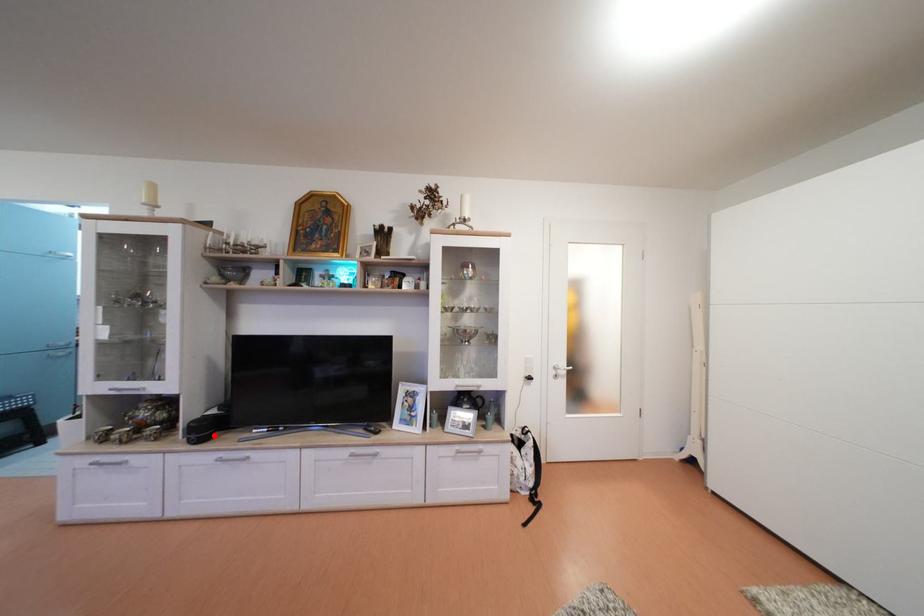
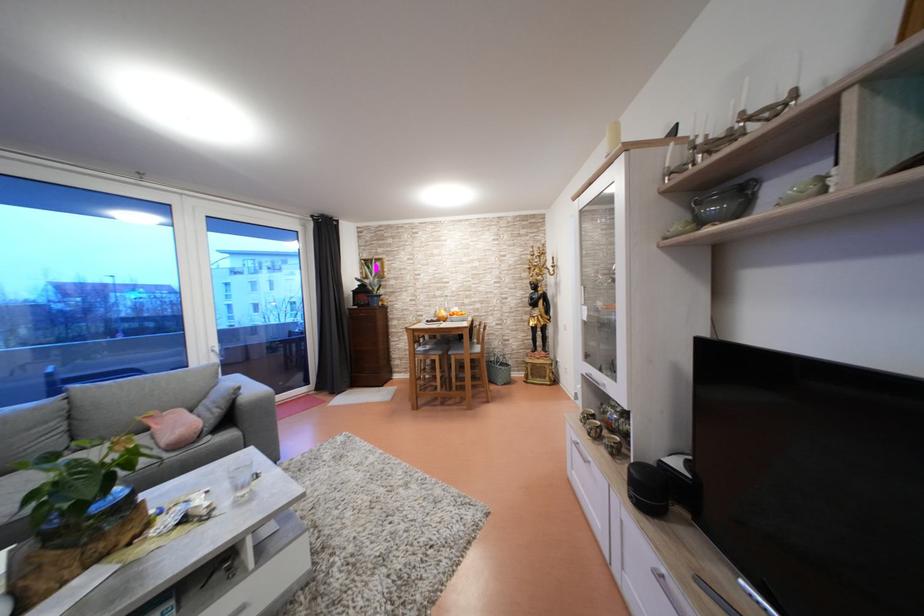
The point at the highlighted location is marked in the first image. Where is the corresponding point in the second image?

(662, 500)